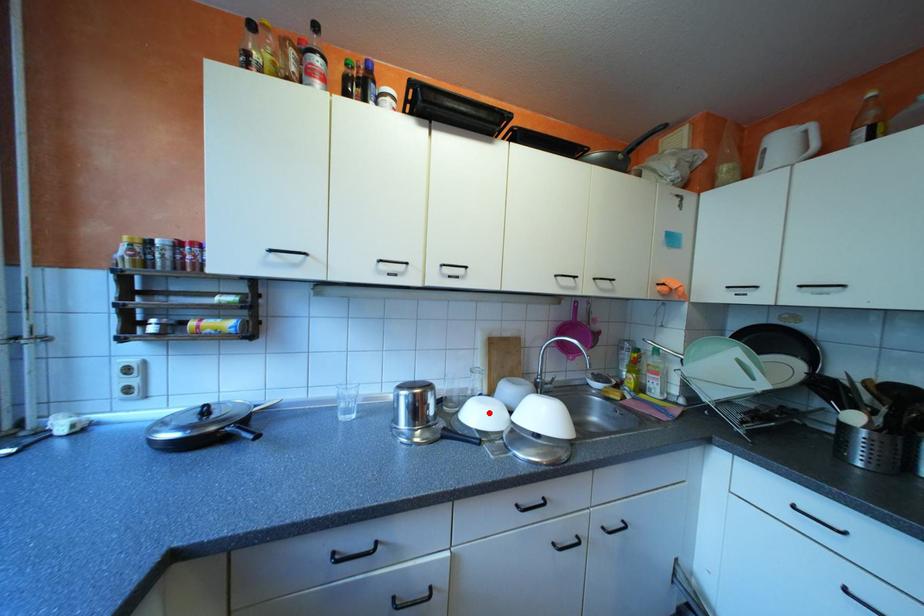
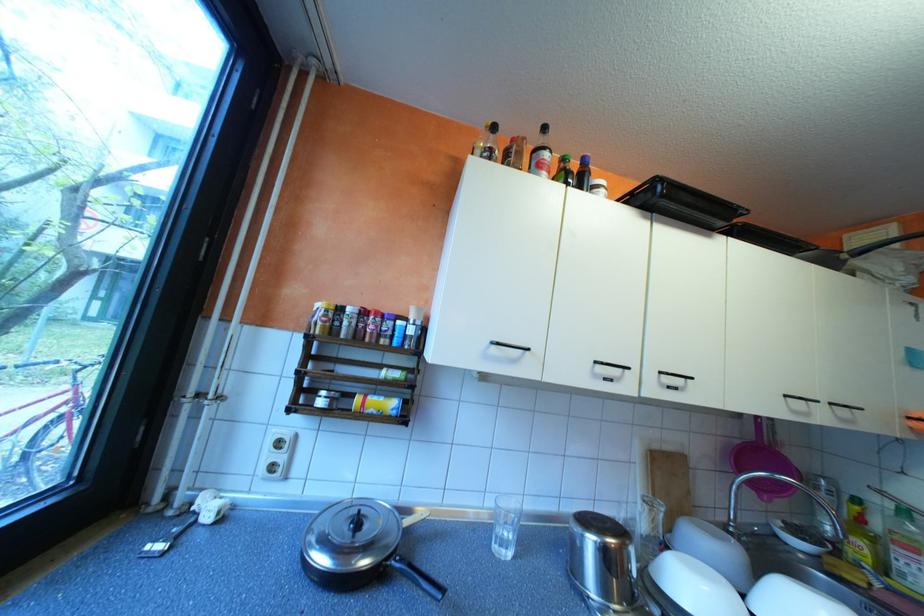
Locate, in the second image, the point that corresponds to the highlighted location in the first image.

(709, 592)